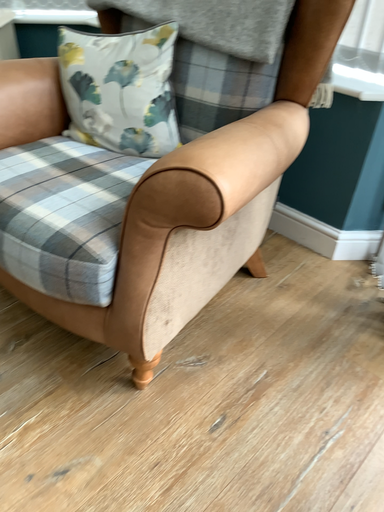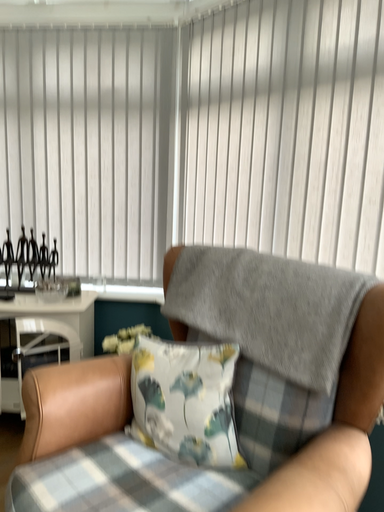
Question: How did the camera likely rotate when shooting the video?

Choices:
 (A) rotated downward
 (B) rotated upward

Answer: (B)